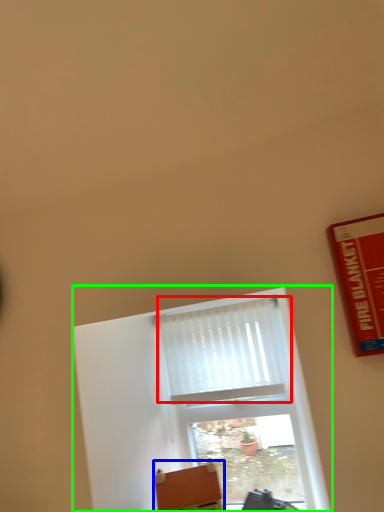
Question: Based on their relative distances, which object is farther from curtain (highlighted by a red box)? Choose from furniture (highlighted by a blue box) and window (highlighted by a green box).

Choices:
 (A) furniture
 (B) window

Answer: (A)